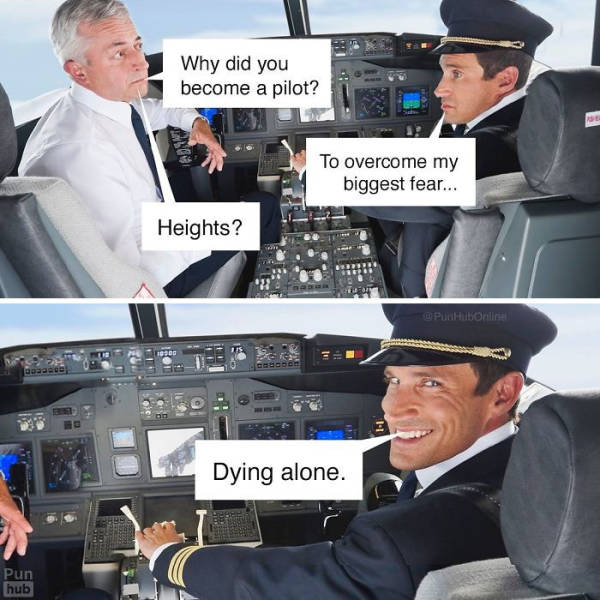
Identify the location of gray headrest. This screenshot has height=600, width=600. (556, 477), (580, 537).